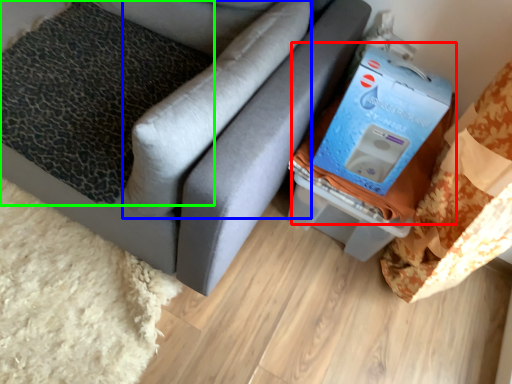
Question: Which is farther away from storage box (highlighted by a red box)? pillow (highlighted by a blue box) or pillow (highlighted by a green box)?

Choices:
 (A) pillow
 (B) pillow

Answer: (B)